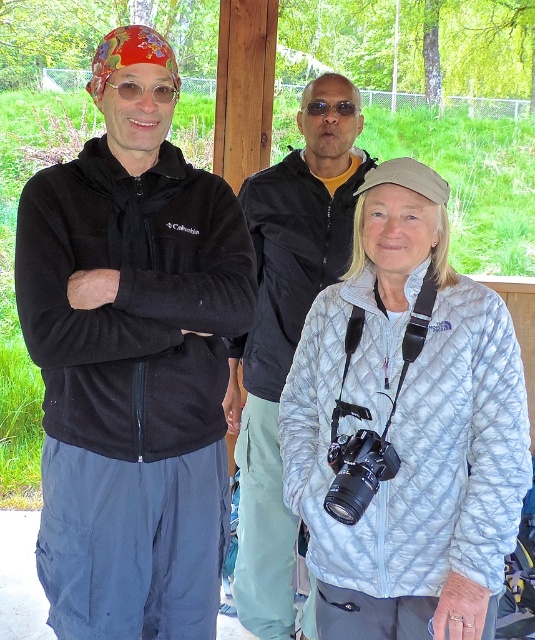
You are a photographer standing 1.5 meters away from the camera. You want to take a photo of the light blue quilted jacket at center without moving the camera. Is it possible to do so?

The light blue quilted jacket at center and camera are 1.50 meters apart from each other, so since you are standing 1.5 meters away from the camera, you can take the photo without moving the camera as the distance matches.

You are a photographer trying to take a group photo of the matte black hoodie at left and the black plastic camera at center. Which object should you focus on first if you want to ensure both are in focus?

The matte black hoodie at left is much taller than the black plastic camera at center, so you should focus on the matte black hoodie at left first to ensure depth of field covers both objects.

You are a photographer trying to take a group photo of the three people in the scene. The light blue quilted jacket at center and the black plastic camera at center are in your frame. Based on their sizes, which object will appear larger in the photo?

The light blue quilted jacket at center will appear larger in the photo because it is taller than the black plastic camera at center.